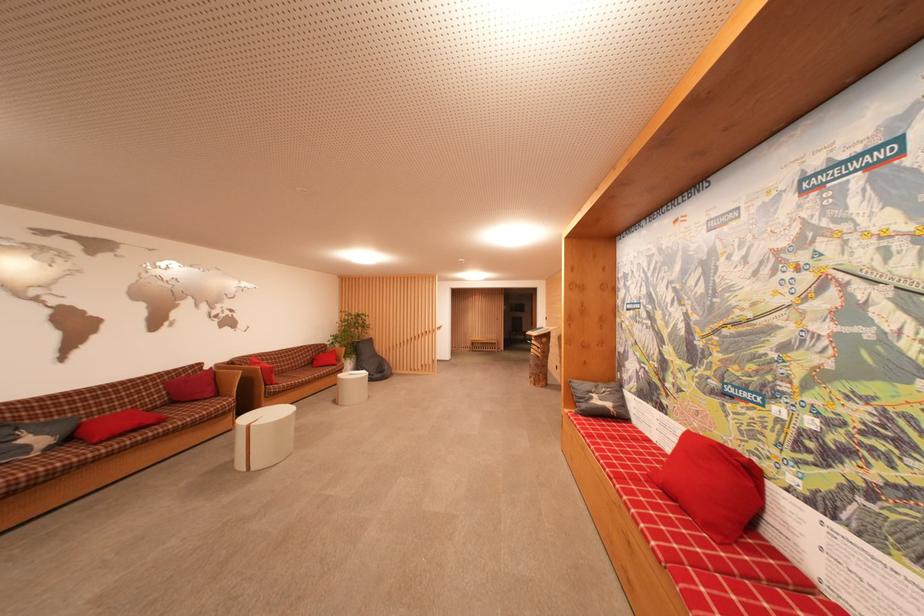
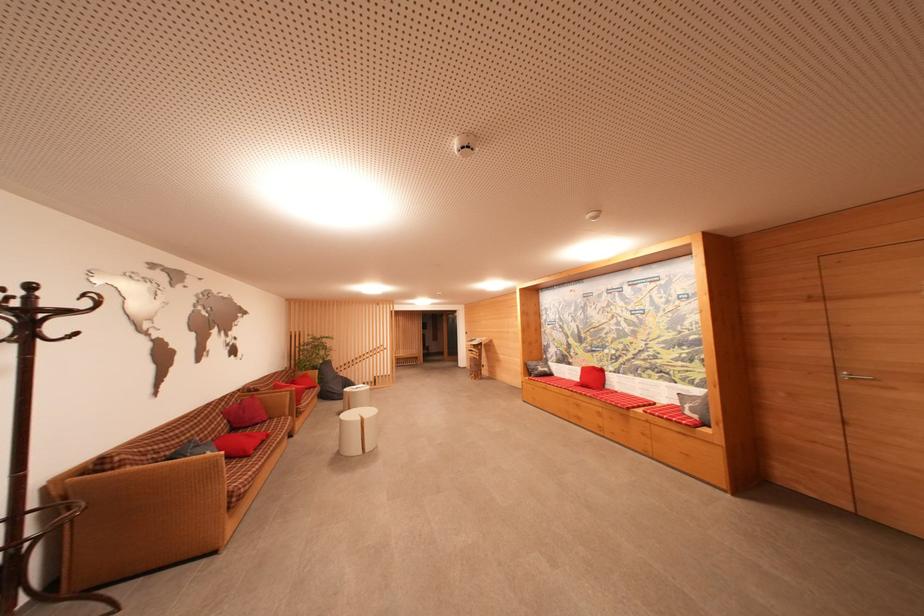
Where in the second image is the point corresponding to point 601,405 from the first image?

(544, 371)